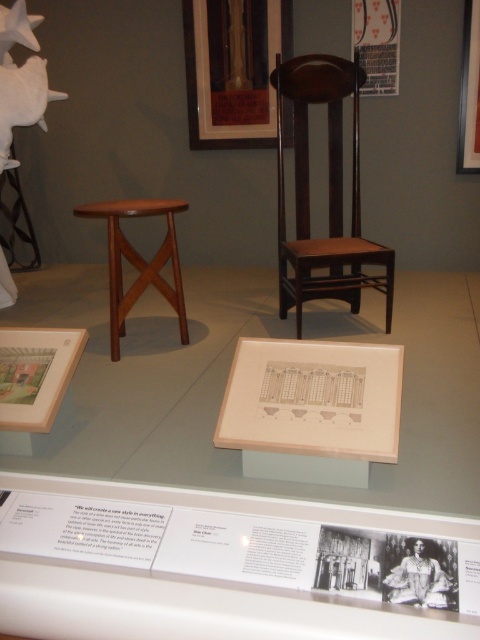
You are standing in front of the museum display and want to touch the two points marked in the scene. Which point, point [76,362] or point [116,289], is closer to you?

Point [76,362] is closer to the viewer than point [116,289].

In the scene shown: You are an art student analyzing the display. You need to determine which object is taller between the matte wood picture frame at upper center and the mahogany wood stool at center. Based on the scene description, which one is taller?

The matte wood picture frame at upper center is taller than the mahogany wood stool at center.

You are an art student who wants to sketch the mahogany wood chair at center and the matte white picture frame at upper right. Which object should you focus on first if you want to draw the one that is closer to the left side of the scene?

The mahogany wood chair at center is positioned on the left side of matte white picture frame at upper right, so it is closer to the left side of the scene. Therefore, you should focus on sketching the mahogany wood chair at center first.